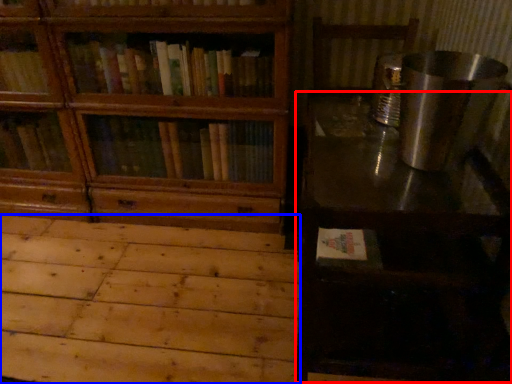
Question: Which of the following is the closest to the observer, table (highlighted by a red box) or plywood (highlighted by a blue box)?

Choices:
 (A) table
 (B) plywood

Answer: (A)